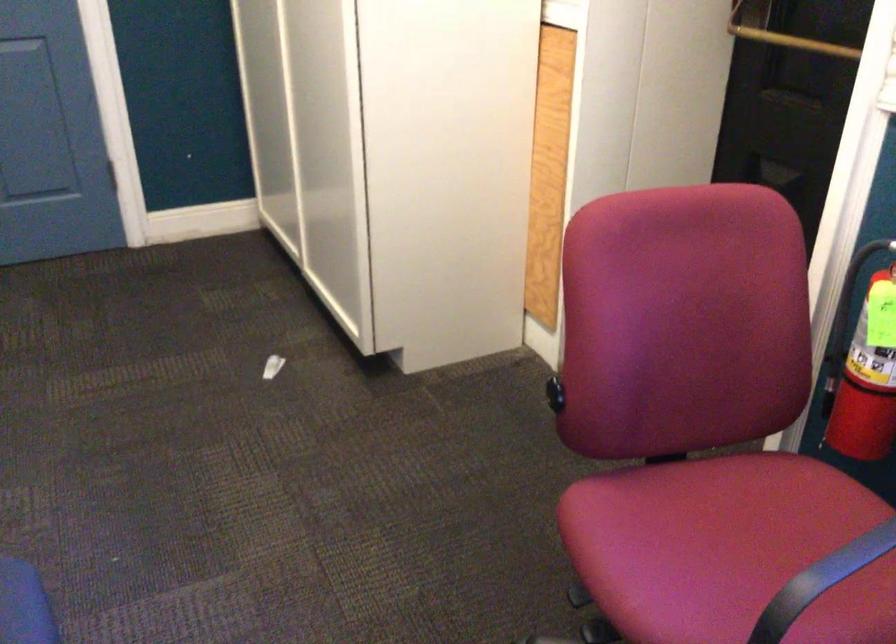
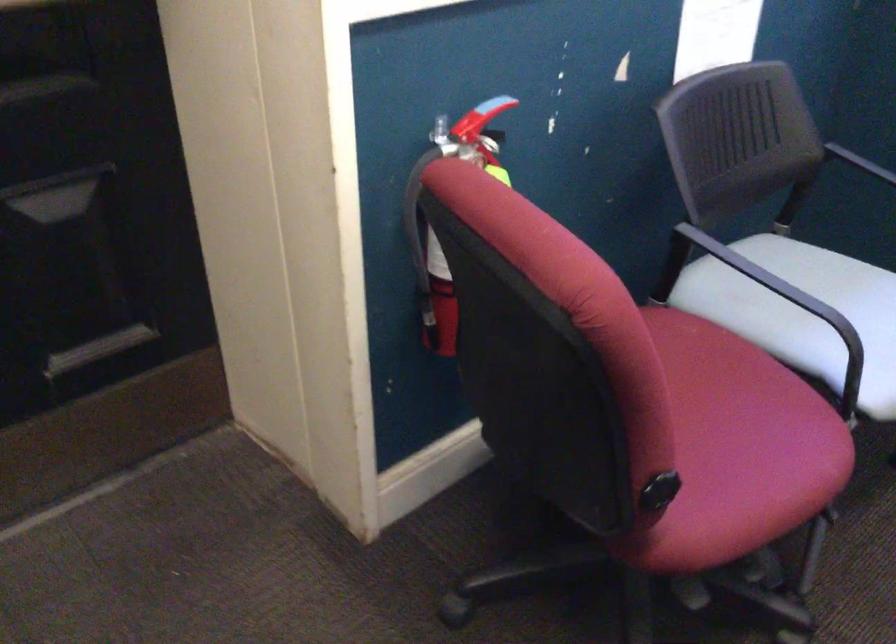
Question: I am providing you with two images of the same scene from different viewpoints. Please identify which objects are invisible in image2.

Choices:
 (A) pink chair sitting surface
 (B) silver fan buttons
 (C) chair adjustment knob
 (D) black chair armrest

Answer: (A)